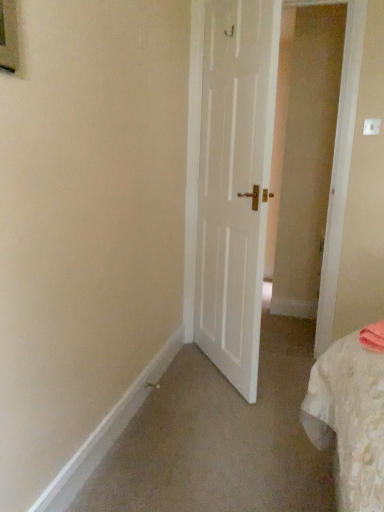
At what (x,y) coordinates should I click in order to perform the action: click on vacant area located to the right-hand side of white matte door at center. Please return your answer as a coordinate pair (x, y). Looking at the image, I should click on (280, 371).